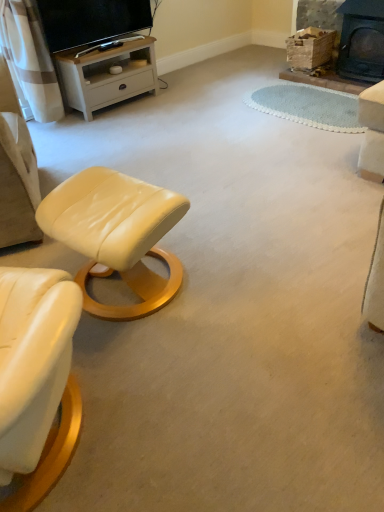
Question: From a real-world perspective, is white wood tv stand at upper left over matte cream leather stool at lower left?

Choices:
 (A) no
 (B) yes

Answer: (A)

Question: From the image's perspective, would you say white wood tv stand at upper left is positioned over matte cream leather stool at lower left?

Choices:
 (A) yes
 (B) no

Answer: (A)

Question: Does white wood tv stand at upper left appear on the right side of matte cream leather stool at lower left?

Choices:
 (A) no
 (B) yes

Answer: (A)

Question: From a real-world perspective, is white wood tv stand at upper left under matte cream leather stool at lower left?

Choices:
 (A) yes
 (B) no

Answer: (A)

Question: Is white wood tv stand at upper left wider than matte cream leather stool at lower left?

Choices:
 (A) no
 (B) yes

Answer: (A)

Question: Is white wood tv stand at upper left beside matte cream leather stool at lower left?

Choices:
 (A) yes
 (B) no

Answer: (B)

Question: Is black cast iron fireplace at upper right at the left side of matte cream leather stool at lower left?

Choices:
 (A) yes
 (B) no

Answer: (B)

Question: Is black cast iron fireplace at upper right in contact with matte cream leather stool at lower left?

Choices:
 (A) yes
 (B) no

Answer: (B)

Question: Are black cast iron fireplace at upper right and matte cream leather stool at lower left far apart?

Choices:
 (A) no
 (B) yes

Answer: (B)

Question: Is the depth of black cast iron fireplace at upper right greater than that of matte cream leather stool at lower left?

Choices:
 (A) no
 (B) yes

Answer: (B)

Question: From the image's perspective, is black cast iron fireplace at upper right on top of matte cream leather stool at lower left?

Choices:
 (A) no
 (B) yes

Answer: (B)

Question: Considering the relative sizes of black cast iron fireplace at upper right and matte cream leather stool at lower left in the image provided, is black cast iron fireplace at upper right wider than matte cream leather stool at lower left?

Choices:
 (A) yes
 (B) no

Answer: (B)

Question: Does matte cream leather stool at lower left have a smaller size compared to matte black tv at upper left?

Choices:
 (A) yes
 (B) no

Answer: (B)